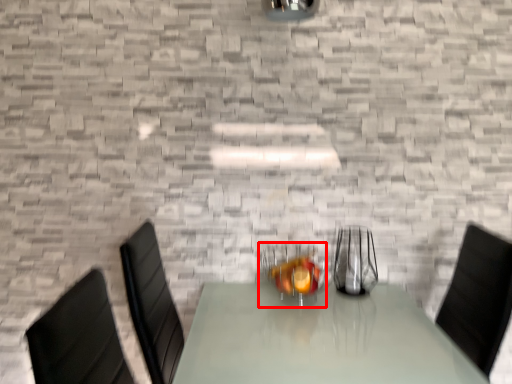
Question: In this image, where is tableware (annotated by the red box) located relative to tableware?

Choices:
 (A) left
 (B) right

Answer: (A)